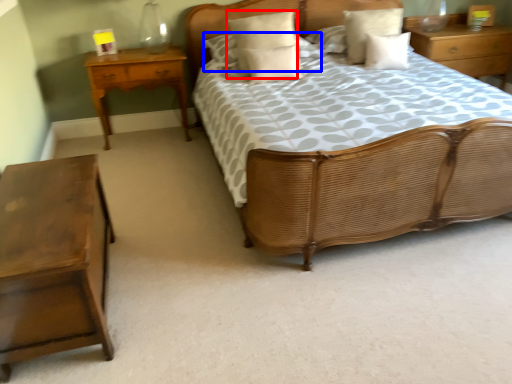
Question: Among these objects, which one is nearest to the camera, pillow (highlighted by a red box) or pillow (highlighted by a blue box)?

Choices:
 (A) pillow
 (B) pillow

Answer: (A)